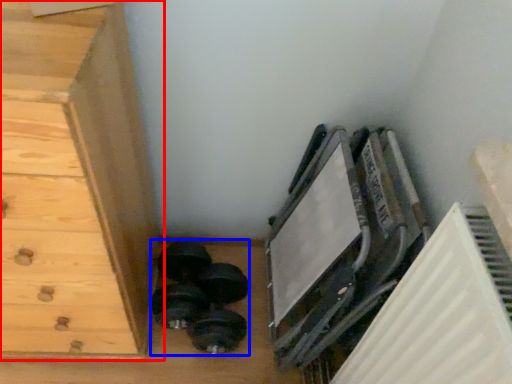
Question: Which object appears farthest to the camera in this image, chest of drawers (highlighted by a red box) or dumbbell (highlighted by a blue box)?

Choices:
 (A) chest of drawers
 (B) dumbbell

Answer: (B)